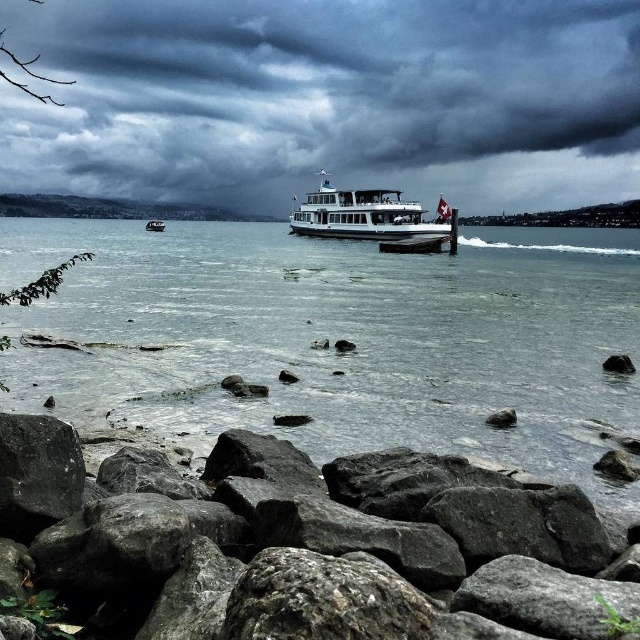
Question: Which point is closer to the camera taking this photo?

Choices:
 (A) (301, 209)
 (B) (154, 221)
 (C) (630, 369)

Answer: (C)

Question: Can you confirm if clear water at lower left is wider than gray rock at lower left?

Choices:
 (A) no
 (B) yes

Answer: (B)

Question: Which is farther from the white glossy ferry at center?

Choices:
 (A) wooden boat at center
 (B) gray rock at lower left
 (C) dark gray cloudy sky at upper center
 (D) clear water at lower left

Answer: (C)

Question: Is dark gray cloudy sky at upper center closer to camera compared to gray rock at lower left?

Choices:
 (A) no
 (B) yes

Answer: (A)

Question: Is clear water at lower left closer to the viewer compared to gray rough rock at lower right?

Choices:
 (A) yes
 (B) no

Answer: (A)

Question: Which is farther from the gray rough rock at lower right?

Choices:
 (A) clear water at lower left
 (B) dark gray cloudy sky at upper center
 (C) white glossy ferry at center
 (D) gray rock at lower left

Answer: (B)